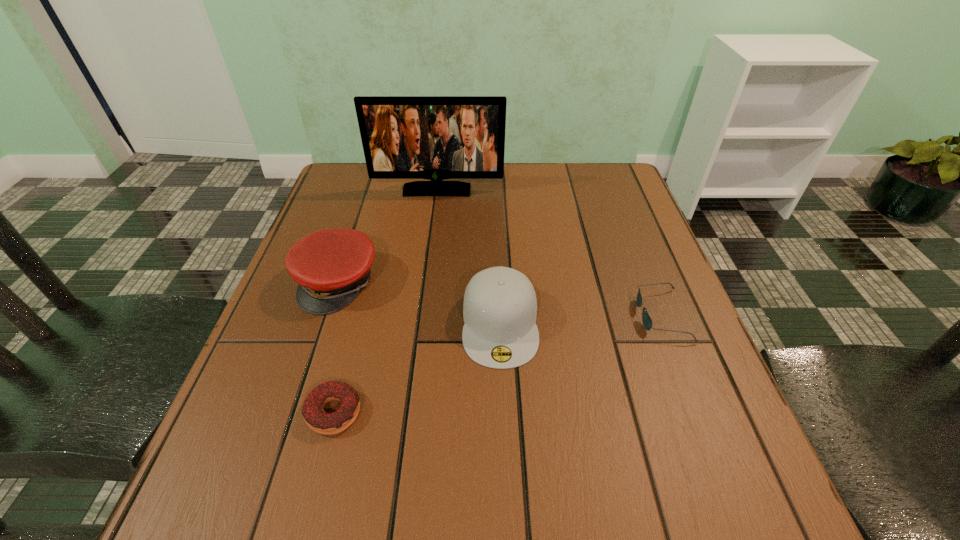
Locate an element on the screen. The width and height of the screenshot is (960, 540). monitor is located at coordinates (404, 137).

Locate an element on the screen. Image resolution: width=960 pixels, height=540 pixels. the tallest object is located at coordinates (404, 137).

Find the location of `the right cap`. the right cap is located at coordinates (500, 307).

Locate an element on the screen. the left cap is located at coordinates (331, 266).

The image size is (960, 540). What are the coordinates of `the rightmost object` in the screenshot? It's located at (647, 322).

Where is `the nearest object`? the nearest object is located at coordinates (316, 418).

Find the location of `free space located on the front-facing side of the monitor`. free space located on the front-facing side of the monitor is located at coordinates (432, 233).

Identify the location of free location located on the front-facing side of the right cap. (508, 495).

The image size is (960, 540). I want to click on vacant area situated 0.210m on the front of the left cap with an emblem, so click(x=297, y=409).

In order to click on vacant area located 0.250m on the lenses of the sunglasses in this screenshot , I will do coord(516,315).